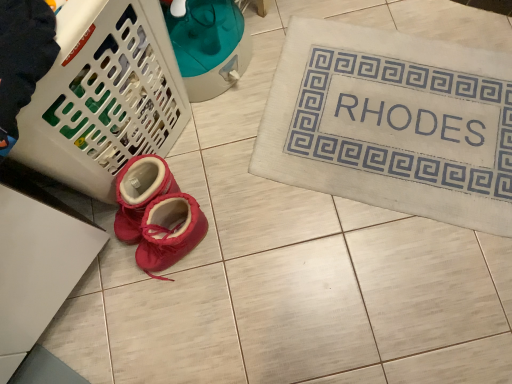
Question: Would you say white plastic laundry basket at lower left is a long distance from matte pink booties at center?

Choices:
 (A) no
 (B) yes

Answer: (A)

Question: Is matte pink booties at center completely or partially inside white plastic laundry basket at lower left?

Choices:
 (A) yes
 (B) no

Answer: (B)

Question: From the image's perspective, does white plastic laundry basket at lower left appear lower than matte pink booties at center?

Choices:
 (A) yes
 (B) no

Answer: (B)

Question: Can you confirm if white plastic laundry basket at lower left is bigger than matte pink booties at center?

Choices:
 (A) yes
 (B) no

Answer: (A)

Question: Considering the relative sizes of white plastic laundry basket at lower left and matte pink booties at center in the image provided, is white plastic laundry basket at lower left wider than matte pink booties at center?

Choices:
 (A) yes
 (B) no

Answer: (A)

Question: Does white plastic laundry basket at lower left have a lesser height compared to matte pink booties at center?

Choices:
 (A) yes
 (B) no

Answer: (B)

Question: From the image's perspective, is beige fabric bath mat at upper right on matte pink booties at center?

Choices:
 (A) yes
 (B) no

Answer: (A)

Question: From a real-world perspective, is beige fabric bath mat at upper right physically above matte pink booties at center?

Choices:
 (A) no
 (B) yes

Answer: (A)

Question: Considering the relative positions of beige fabric bath mat at upper right and matte pink booties at center in the image provided, is beige fabric bath mat at upper right to the right of matte pink booties at center from the viewer's perspective?

Choices:
 (A) no
 (B) yes

Answer: (B)

Question: Is the position of beige fabric bath mat at upper right less distant than that of matte pink booties at center?

Choices:
 (A) yes
 (B) no

Answer: (B)

Question: Is beige fabric bath mat at upper right far from matte pink booties at center?

Choices:
 (A) no
 (B) yes

Answer: (A)

Question: Is beige fabric bath mat at upper right smaller than matte pink booties at center?

Choices:
 (A) yes
 (B) no

Answer: (B)

Question: From a real-world perspective, is matte pink booties at center located higher than white plastic laundry basket at lower left?

Choices:
 (A) yes
 (B) no

Answer: (B)